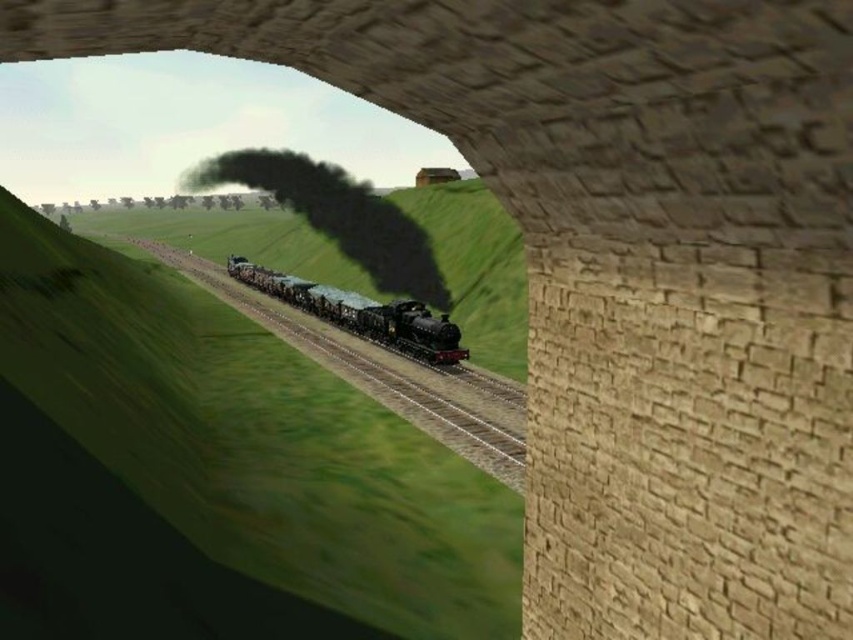
This screenshot has height=640, width=853. What do you see at coordinates (387, 374) in the screenshot? I see `shiny black track at center` at bounding box center [387, 374].

Can you confirm if shiny black track at center is taller than polished black locomotive at center?

Indeed, shiny black track at center has a greater height compared to polished black locomotive at center.

This screenshot has width=853, height=640. What do you see at coordinates (387, 374) in the screenshot?
I see `shiny black track at center` at bounding box center [387, 374].

Find the location of a particular element. Image resolution: width=853 pixels, height=640 pixels. shiny black track at center is located at coordinates (387, 374).

Is black matte steam at center closer to camera compared to polished black locomotive at center?

No, it is behind polished black locomotive at center.

Does black matte steam at center have a lesser height compared to polished black locomotive at center?

No.

At what (x,y) coordinates should I click in order to perform the action: click on black matte steam at center. Please return your answer as a coordinate pair (x, y). The width and height of the screenshot is (853, 640). Looking at the image, I should click on (337, 216).

Who is more distant from viewer, (192,268) or (393,205)?

Point (192,268)

Does shiny black track at center have a lesser width compared to black matte steam at center?

Yes.

Which is in front, point (257, 301) or point (373, 230)?

Point (257, 301) is in front.

This screenshot has height=640, width=853. I want to click on shiny black track at center, so click(x=387, y=374).